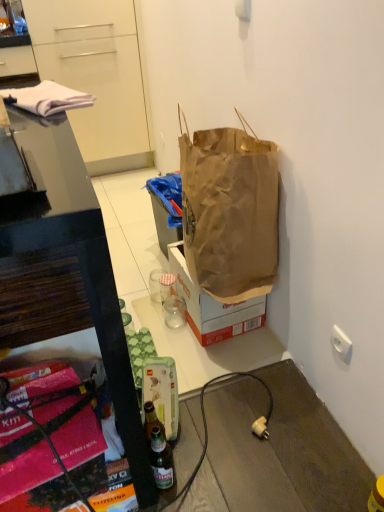
Where is `free location above white cloth at upper left (from a real-world perspective)`? free location above white cloth at upper left (from a real-world perspective) is located at coordinates (42, 90).